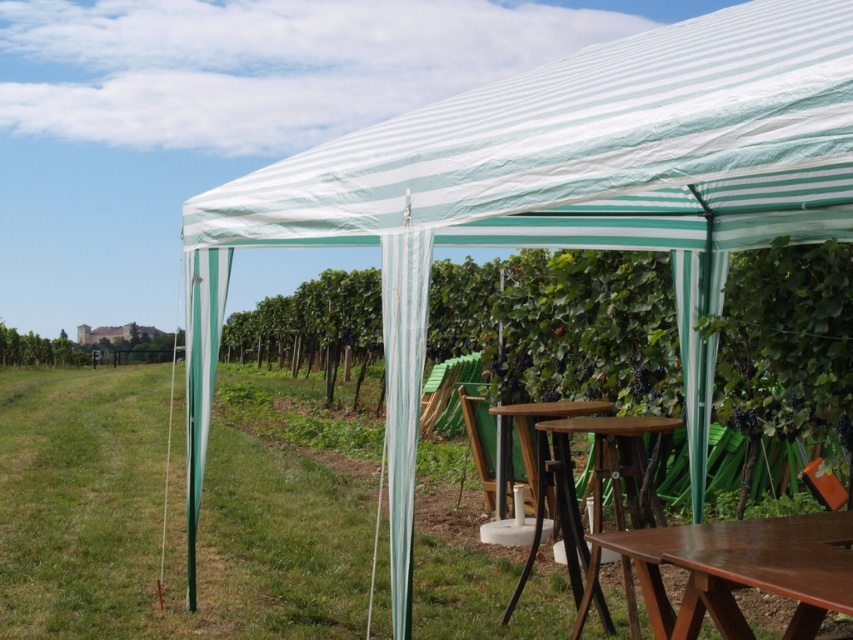
You are planning to set up a picnic blanket in the vineyard scene. The picnic blanket is 2 meters wide. You see the green grass at center and the brown wooden table at lower right. Which area can accommodate the picnic blanket without folding it?

The green grass at center has a larger width than the brown wooden table at lower right, so the picnic blanket can be placed on the green grass at center without folding since it has enough space.

You are planning to host a small gathering for 6 people. You have a wooden picnic table at center and a wooden at center available. Which one can accommodate more guests comfortably?

The wooden picnic table at center is bigger than wooden at center, so it can accommodate more guests comfortably.

You are planning to set up a small table for two in the vineyard scene. You have a wooden picnic table at center and a wooden at center. Which object should you move to the left to make space for the new table?

You should move the wooden at center to the left since the wooden picnic table at center is already to the right of it, creating space for the new table.